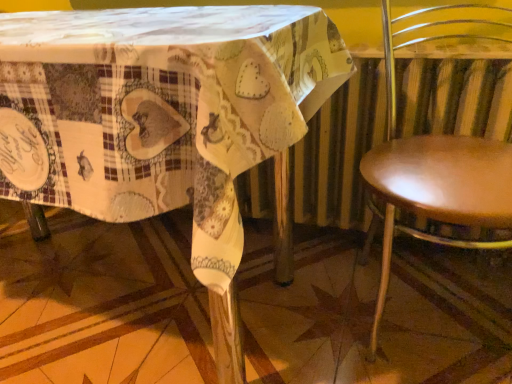
Locate an element on the screen. Image resolution: width=512 pixels, height=384 pixels. printed fabric table at center is located at coordinates (162, 119).

In order to face printed fabric table at center, should I rotate leftwards or rightwards?

You should rotate left by 23.327 degrees.

The height and width of the screenshot is (384, 512). Describe the element at coordinates (162, 119) in the screenshot. I see `printed fabric table at center` at that location.

Measure the distance between point (401, 156) and camera.

Point (401, 156) and camera are 35.24 inches apart from each other.

Measure the distance between shiny brown seat at right and camera.

A distance of 27.53 inches exists between shiny brown seat at right and camera.

Describe the element at coordinates (439, 157) in the screenshot. The image size is (512, 384). I see `shiny brown seat at right` at that location.

This screenshot has height=384, width=512. What are the coordinates of `shiny brown seat at right` in the screenshot? It's located at (439, 157).

This screenshot has width=512, height=384. Find the location of `printed fabric table at center`. printed fabric table at center is located at coordinates (162, 119).

In the scene shown: Considering the positions of objects printed fabric table at center and shiny brown seat at right in the image provided, who is more to the right, printed fabric table at center or shiny brown seat at right?

Positioned to the right is shiny brown seat at right.

Does printed fabric table at center come in front of shiny brown seat at right?

Yes, it is.

Is point (99, 219) farther from camera compared to point (381, 192)?

Yes.

From the image's perspective, which one is positioned higher, printed fabric table at center or shiny brown seat at right?

printed fabric table at center, from the image's perspective.

From a real-world perspective, which object rests below the other?

shiny brown seat at right, from a real-world perspective.

Based on the photo, between printed fabric table at center and shiny brown seat at right, which one has larger width?

printed fabric table at center is wider.

From their relative heights in the image, would you say printed fabric table at center is taller or shorter than shiny brown seat at right?

Considering their sizes, printed fabric table at center has less height than shiny brown seat at right.

Considering the sizes of objects printed fabric table at center and shiny brown seat at right in the image provided, who is bigger, printed fabric table at center or shiny brown seat at right?

printed fabric table at center is bigger.

Is printed fabric table at center inside the boundaries of shiny brown seat at right, or outside?

printed fabric table at center is located beyond the bounds of shiny brown seat at right.

Is printed fabric table at center touching shiny brown seat at right?

No, printed fabric table at center is not in contact with shiny brown seat at right.

Is printed fabric table at center aimed at shiny brown seat at right?

No, printed fabric table at center does not turn towards shiny brown seat at right.

How far apart are printed fabric table at center and shiny brown seat at right?

15.30 inches.

What are the coordinates of `table above the shiny brown seat at right (from a real-world perspective)` in the screenshot? It's located at (162, 119).

Considering the relative positions of shiny brown seat at right and printed fabric table at center in the image provided, is shiny brown seat at right to the right of printed fabric table at center from the viewer's perspective?

Yes.

Is the position of shiny brown seat at right less distant than that of printed fabric table at center?

No, shiny brown seat at right is behind printed fabric table at center.

Considering the points (450, 181) and (312, 14), which point is in front, point (450, 181) or point (312, 14)?

The point (450, 181) is closer.

From the image's perspective, which one is positioned lower, shiny brown seat at right or printed fabric table at center?

shiny brown seat at right.

From a real-world perspective, who is located lower, shiny brown seat at right or printed fabric table at center?

shiny brown seat at right is physically lower.

Which object is wider, shiny brown seat at right or printed fabric table at center?

printed fabric table at center.

Does shiny brown seat at right have a lesser height compared to printed fabric table at center?

Incorrect, the height of shiny brown seat at right does not fall short of that of printed fabric table at center.

Is shiny brown seat at right smaller than printed fabric table at center?

Indeed, shiny brown seat at right has a smaller size compared to printed fabric table at center.

Based on the photo, is shiny brown seat at right spatially inside printed fabric table at center, or outside of it?

shiny brown seat at right is spatially situated outside printed fabric table at center.

Is shiny brown seat at right touching printed fabric table at center?

There is a gap between shiny brown seat at right and printed fabric table at center.

Is printed fabric table at center at the back of shiny brown seat at right?

No.

How many degrees apart are the facing directions of shiny brown seat at right and printed fabric table at center?

The angle between the facing direction of shiny brown seat at right and the facing direction of printed fabric table at center is 0.00046 degrees.

You are a GUI agent. You are given a task and a screenshot of the screen. Output one action in this format:
    pyautogui.click(x=<x>, y=<y>)
    Task: Click on the chair below the printed fabric table at center (from the image's perspective)
    
    Given the screenshot: What is the action you would take?
    pyautogui.click(x=439, y=157)

Identify the location of chair that is below the printed fabric table at center (from the image's perspective). (439, 157).

The width and height of the screenshot is (512, 384). Identify the location of table in front of the shiny brown seat at right. 162,119.